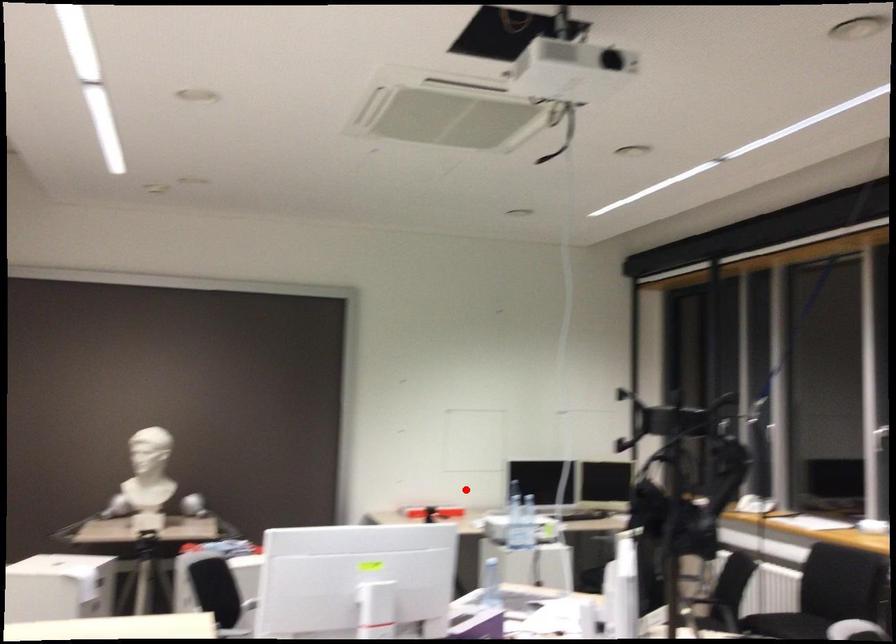
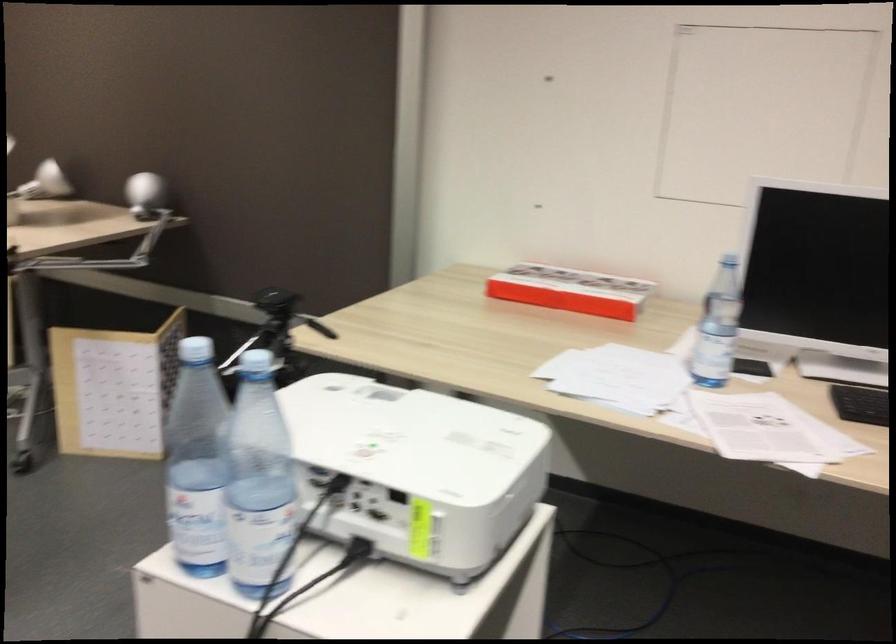
Question: I am providing you with two images of the same scene from different viewpoints. In image1, a red point is highlighted. Considering the same 3D point in image2, which of the following is correct?

Choices:
 (A) It is closer
 (B) It is farther

Answer: (A)